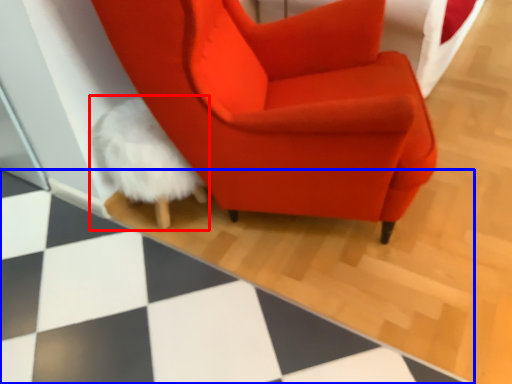
Question: Which object is further to the camera taking this photo, bean bag chair (highlighted by a red box) or tile (highlighted by a blue box)?

Choices:
 (A) bean bag chair
 (B) tile

Answer: (A)